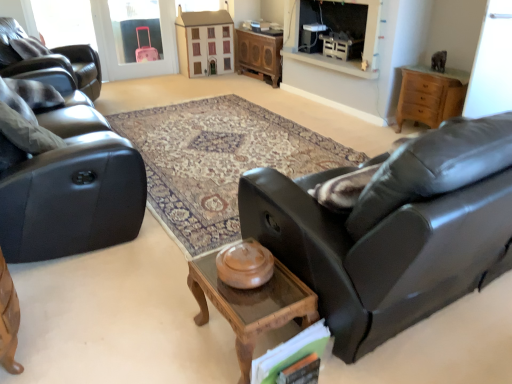
Question: From the image's perspective, is wooden cabinet at center over matte black recliner at left?

Choices:
 (A) no
 (B) yes

Answer: (B)

Question: Is the position of wooden cabinet at center less distant than that of matte black recliner at left?

Choices:
 (A) yes
 (B) no

Answer: (B)

Question: Is wooden cabinet at center outside matte black recliner at left?

Choices:
 (A) yes
 (B) no

Answer: (A)

Question: Is wooden cabinet at center facing towards matte black recliner at left?

Choices:
 (A) yes
 (B) no

Answer: (A)

Question: Can you confirm if wooden cabinet at center is positioned to the right of matte black recliner at left?

Choices:
 (A) yes
 (B) no

Answer: (A)

Question: In terms of height, does transparent glass door at upper right look taller or shorter compared to white plastic corded phone at upper center?

Choices:
 (A) tall
 (B) short

Answer: (A)

Question: Is transparent glass door at upper right inside the boundaries of white plastic corded phone at upper center, or outside?

Choices:
 (A) inside
 (B) outside

Answer: (B)

Question: Considering the positions of transparent glass door at upper right and white plastic corded phone at upper center in the image, is transparent glass door at upper right wider or thinner than white plastic corded phone at upper center?

Choices:
 (A) wide
 (B) thin

Answer: (B)

Question: Relative to white plastic corded phone at upper center, is transparent glass door at upper right in front or behind?

Choices:
 (A) front
 (B) behind

Answer: (A)

Question: Visually, is wooden cabinet at center positioned to the left or to the right of wooden glass coffee table at center?

Choices:
 (A) left
 (B) right

Answer: (B)

Question: Considering their positions, is wooden cabinet at center located in front of or behind wooden glass coffee table at center?

Choices:
 (A) behind
 (B) front

Answer: (A)

Question: Based on their sizes in the image, would you say wooden cabinet at center is bigger or smaller than wooden glass coffee table at center?

Choices:
 (A) big
 (B) small

Answer: (A)

Question: Is point (251, 74) positioned closer to the camera than point (239, 365)?

Choices:
 (A) farther
 (B) closer

Answer: (A)

Question: From their relative heights in the image, would you say matte black recliner at left is taller or shorter than matte brown wooden dresser at upper center?

Choices:
 (A) tall
 (B) short

Answer: (B)

Question: From a real-world perspective, is matte black recliner at left positioned above or below matte brown wooden dresser at upper center?

Choices:
 (A) below
 (B) above

Answer: (B)